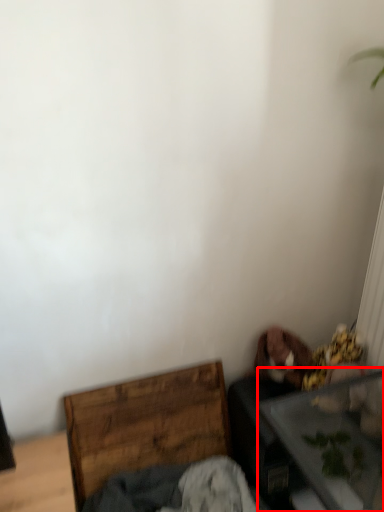
Question: From the image's perspective, where is table (annotated by the red box) located in relation to furniture in the image?

Choices:
 (A) below
 (B) above

Answer: (A)